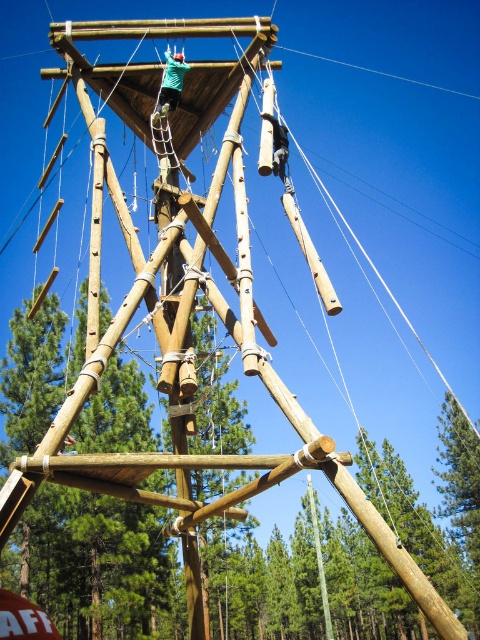
You are standing at the base of the wooden climbing structure and want to reach the platform where the climber in the teal shirt is. There are two points marked on the structure that you can see from your position. Which point, point (168, 611) or point (312, 499), is closer to you?

Point (168, 611) is in front of point (312, 499), so it is closer to you.

In the scene shown: You are a safety inspector evaluating the climbing structure. You notice a point marked at coordinates [91,563]. Based on the scene description, what object is located at this point?

The point at coordinates [91,563] indicates the natural wood pole at center.